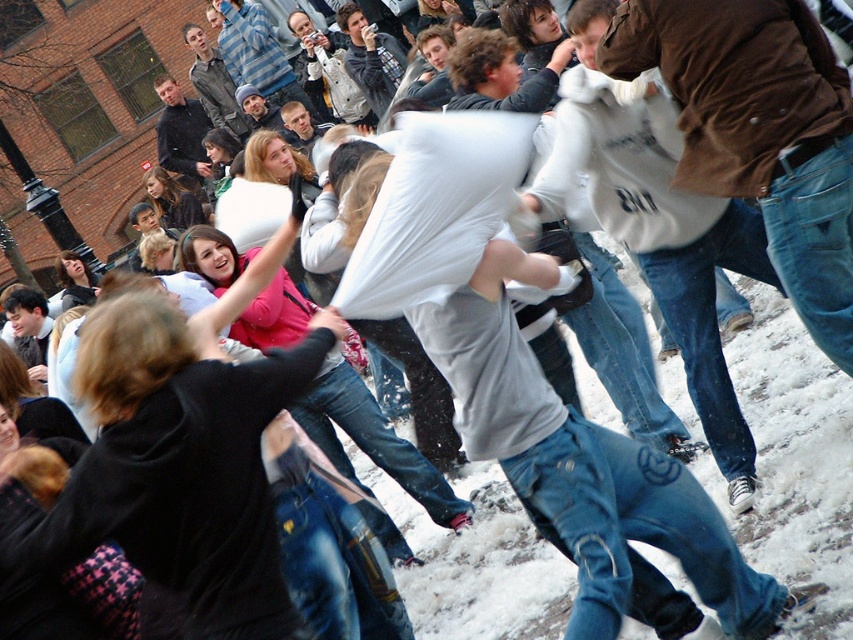
You are standing at the point marked as point (589,476) in the image. What object is located exactly at this point?

The point (589,476) indicates the location of the white cotton pillow at center.

You are a photographer standing at the edge of the pillow fight scene. You want to take a photo of both the brown leather jacket at upper right and the brushed metal jacket at upper center. Which jacket should you focus on first to ensure both are in the frame?

You should focus on the brushed metal jacket at upper center first because the brown leather jacket at upper right is positioned under it, so adjusting the frame to include the upper jacket will naturally include the lower one as well.